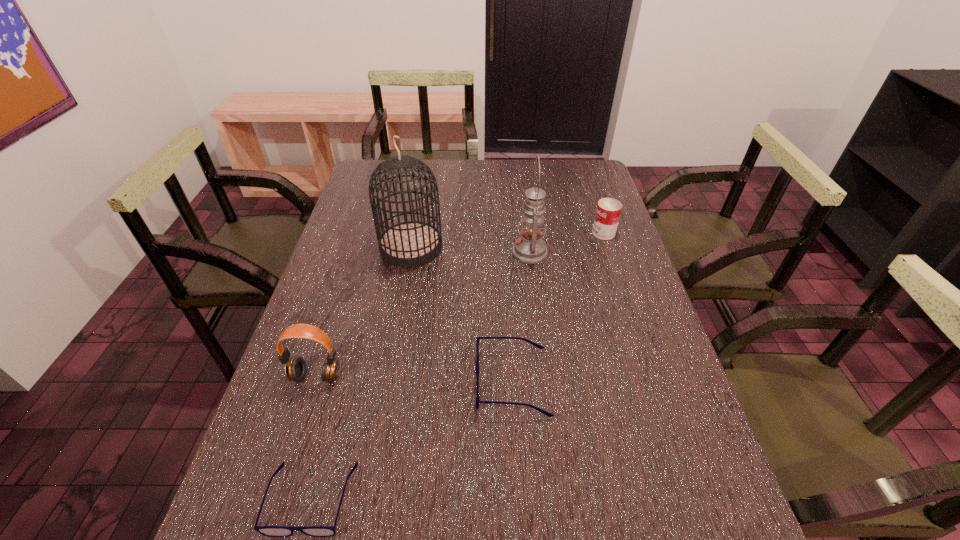
At what (x,y) coordinates should I click in order to perform the action: click on the shorter spectacles. Please return your answer as a coordinate pair (x, y). Looking at the image, I should click on (270, 531).

Locate an element on the screen. the left spectacles is located at coordinates (270, 531).

Locate an element on the screen. the fifth tallest object is located at coordinates (548, 414).

This screenshot has height=540, width=960. I want to click on the farther spectacles, so click(548, 414).

Where is `oil lamp`? oil lamp is located at coordinates pyautogui.click(x=530, y=248).

Where is `birdcage`? The width and height of the screenshot is (960, 540). birdcage is located at coordinates (412, 243).

The image size is (960, 540). I want to click on headset, so click(x=295, y=368).

You are a GUI agent. You are given a task and a screenshot of the screen. Output one action in this format:
    pyautogui.click(x=<x>, y=<y>)
    Task: Click on the can
    The image size is (960, 540).
    Given the screenshot: What is the action you would take?
    pyautogui.click(x=608, y=211)

At what (x,y) coordinates should I click in order to perform the action: click on the third shortest object. Please return your answer as a coordinate pair (x, y). This screenshot has width=960, height=540. Looking at the image, I should click on coord(608,211).

Find the location of a particular element. The image size is (960, 540). vacant space located 0.210m on the front-facing side of the taller spectacles is located at coordinates point(386,382).